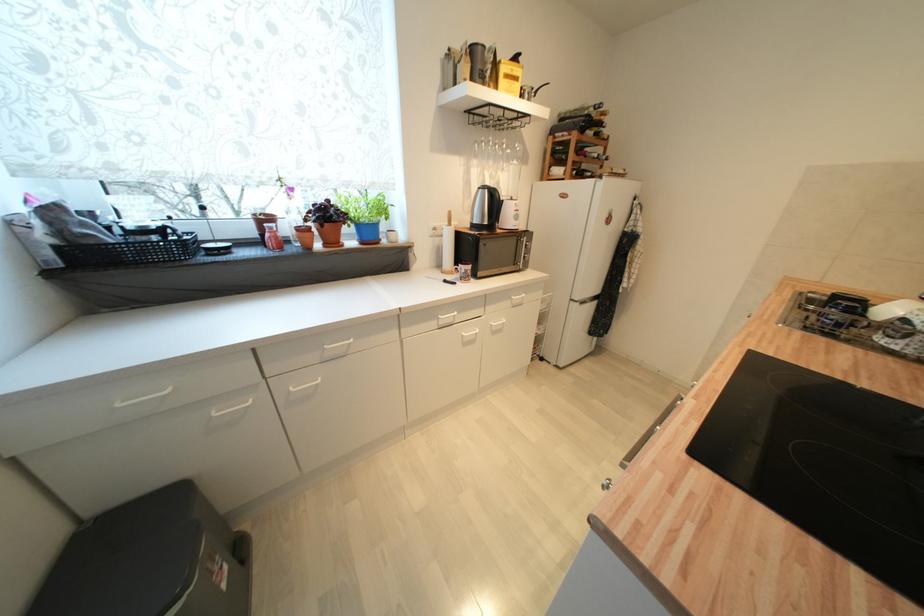
Identify the location of paper towel roll. Image resolution: width=924 pixels, height=616 pixels. (447, 249).